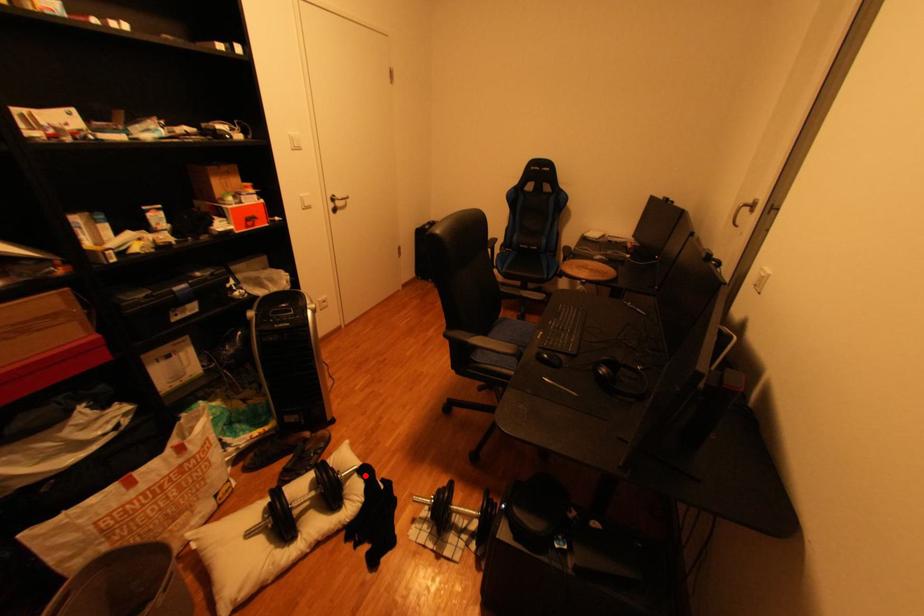
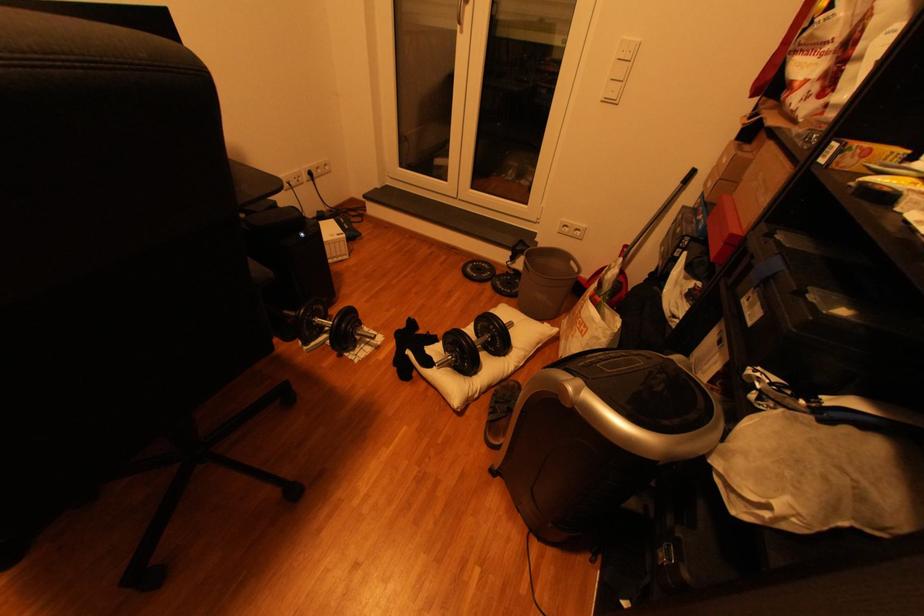
Question: I am providing you with two images of the same scene from different viewpoints. In image1, a red point is highlighted. Considering the same 3D point in image2, which of the following is correct?

Choices:
 (A) It is closer
 (B) It is farther

Answer: (B)